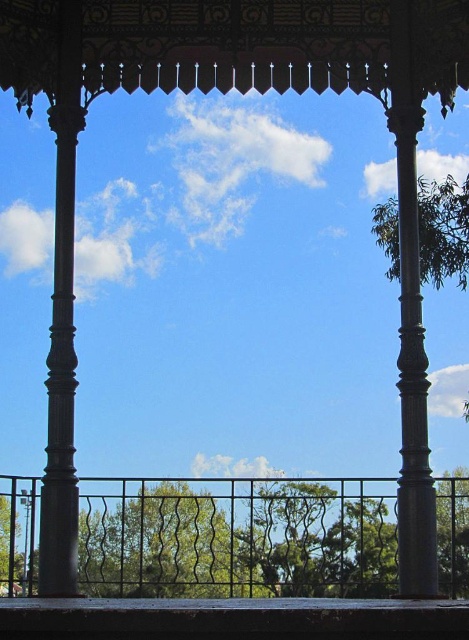
Question: Is green leafy tree at center above metallic silver pole at lower left?

Choices:
 (A) yes
 (B) no

Answer: (B)

Question: Which of the following is the closest to the observer?

Choices:
 (A) (24, 502)
 (B) (467, 497)

Answer: (A)

Question: Which of the following is the farthest from the observer?

Choices:
 (A) metallic silver pole at lower left
 (B) green leafy tree at center

Answer: (A)

Question: Does green leafy tree at center have a larger size compared to metallic silver pole at lower left?

Choices:
 (A) no
 (B) yes

Answer: (B)

Question: Which point is closer to the camera?

Choices:
 (A) metallic silver pole at lower left
 (B) green leafy tree at center

Answer: (B)

Question: Does green leafy tree at center have a larger size compared to metallic silver pole at lower left?

Choices:
 (A) yes
 (B) no

Answer: (A)